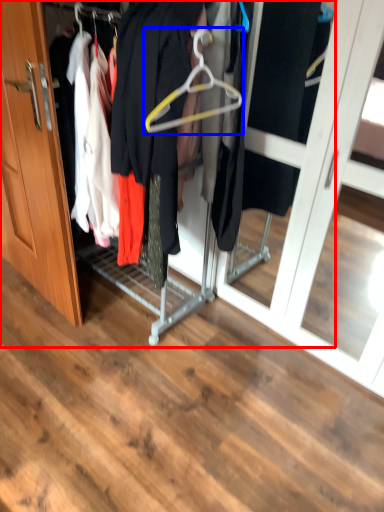
Question: Which object appears closest to the camera in this image, closet (highlighted by a red box) or hanger (highlighted by a blue box)?

Choices:
 (A) closet
 (B) hanger

Answer: (A)